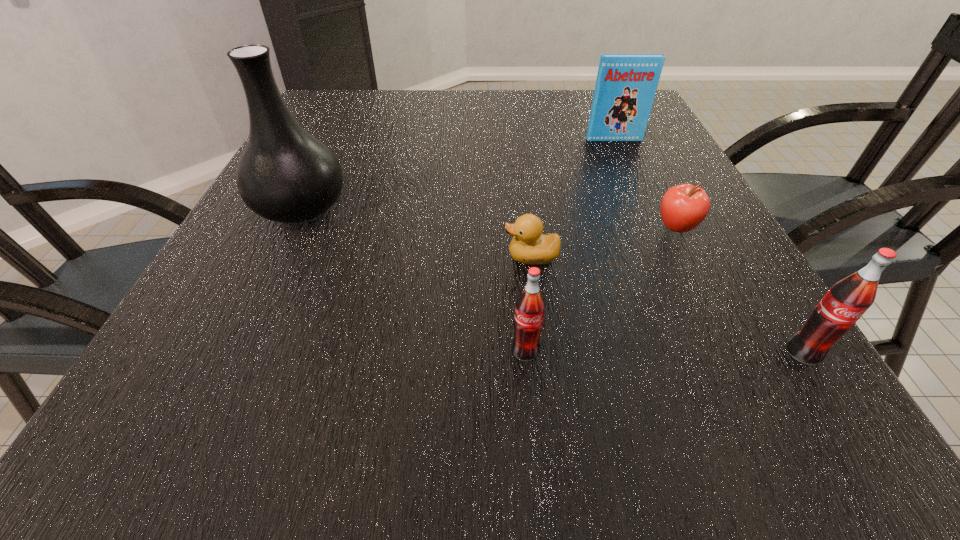
The height and width of the screenshot is (540, 960). Find the location of `free space between the third shortest object and the leftmost object`. free space between the third shortest object and the leftmost object is located at coordinates (413, 279).

Image resolution: width=960 pixels, height=540 pixels. I want to click on vacant space in between the farthest object and the fourth tallest object, so click(x=569, y=245).

Identify the location of vacant region between the fourth farthest object and the taller soda bottle. (667, 305).

Locate an element on the screen. The width and height of the screenshot is (960, 540). free space between the fourth tallest object and the right soda bottle is located at coordinates (664, 352).

Locate an element on the screen. This screenshot has width=960, height=540. object that is the closest one to the shorter soda bottle is located at coordinates (529, 246).

Identify the location of the fifth closest object relative to the vase. (846, 301).